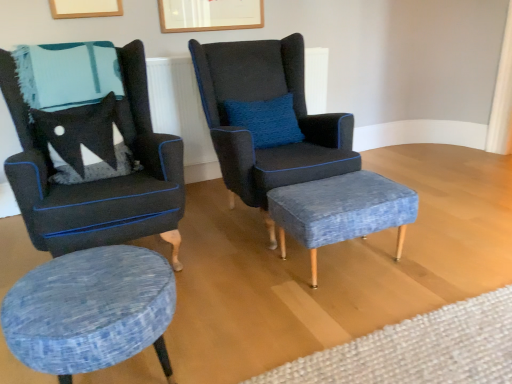
At what (x,y) coordinates should I click in order to perform the action: click on free space between textured blue fabric stool at lower left, arranged as the 2th stool when viewed from the back, and white textured rug at lower right, the 2th plain positioned from the front. Please return your answer as a coordinate pair (x, y). This screenshot has height=384, width=512. Looking at the image, I should click on (297, 328).